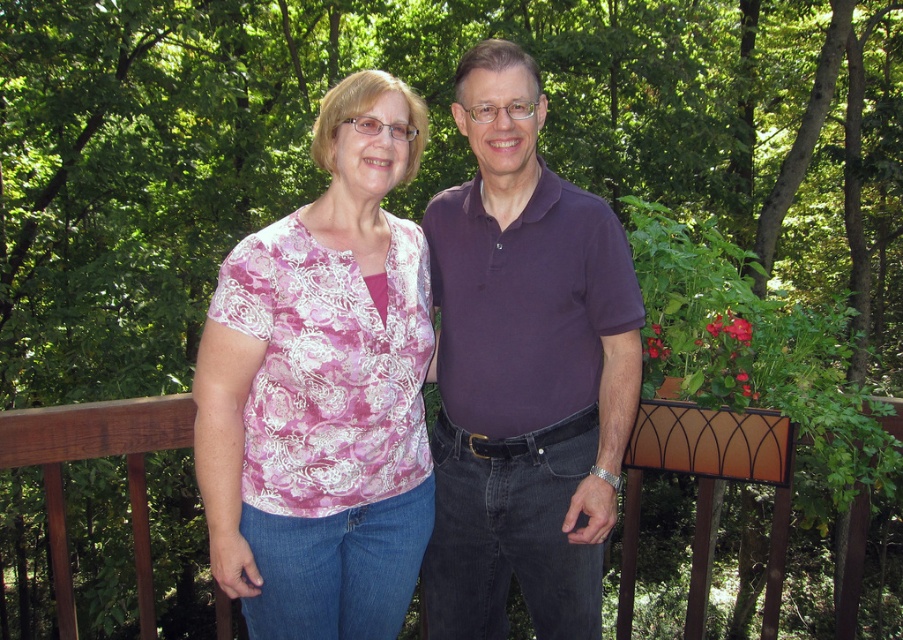
How distant is pink floral blouse at center from purple cotton shirt at center?

The distance of pink floral blouse at center from purple cotton shirt at center is 12.46 inches.

Does point (287, 604) lie in front of point (497, 428)?

That is True.

Locate an element on the screen. The width and height of the screenshot is (903, 640). pink floral blouse at center is located at coordinates (323, 388).

Does purple cotton shirt at center appear under brown wooden rail at center?

No.

Image resolution: width=903 pixels, height=640 pixels. Find the location of `purple cotton shirt at center`. purple cotton shirt at center is located at coordinates (524, 371).

What are the coordinates of `purple cotton shirt at center` in the screenshot? It's located at (524, 371).

Is pink floral blouse at center wider than brown wooden rail at center?

No, pink floral blouse at center is not wider than brown wooden rail at center.

Does point (332, 612) come in front of point (62, 557)?

Yes.

The height and width of the screenshot is (640, 903). I want to click on pink floral blouse at center, so click(323, 388).